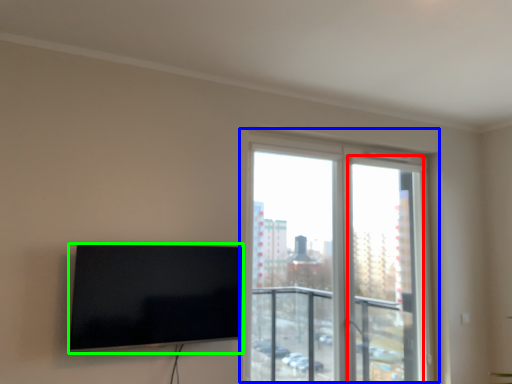
Question: Based on their relative distances, which object is nearer to screen door (highlighted by a red box)? Choose from window (highlighted by a blue box) and television (highlighted by a green box).

Choices:
 (A) window
 (B) television

Answer: (A)